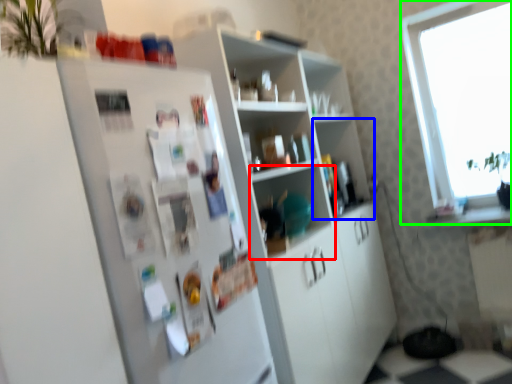
Question: Considering the real-world distances, which object is closest to shelf (highlighted by a red box)? shelf (highlighted by a blue box) or window (highlighted by a green box).

Choices:
 (A) shelf
 (B) window

Answer: (A)